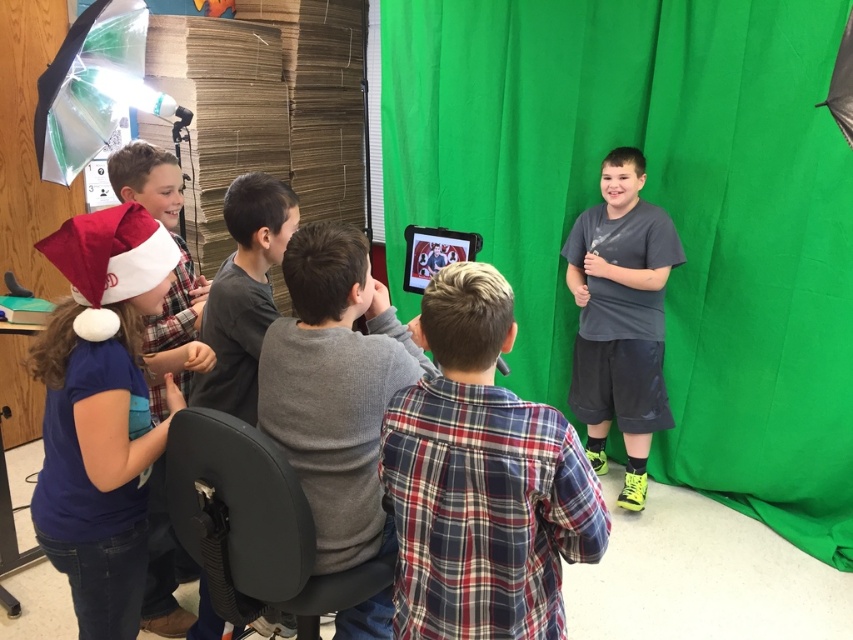
Question: Can you confirm if plaid fabric shirt at center is positioned above gray matte shirt at right?

Choices:
 (A) yes
 (B) no

Answer: (B)

Question: Which point is closer to the camera taking this photo?

Choices:
 (A) (668, 241)
 (B) (84, 394)
 (C) (560, 216)
 (D) (273, 244)

Answer: (B)

Question: Among these points, which one is nearest to the camera?

Choices:
 (A) (428, 627)
 (B) (190, 566)
 (C) (206, 384)

Answer: (A)

Question: Which of these objects is positioned farthest from the gray matte shirt at center?

Choices:
 (A) gray cotton shirt at center
 (B) plaid fabric shirt at center

Answer: (B)

Question: Can you confirm if green fabric curtain at center is thinner than gray matte shirt at right?

Choices:
 (A) no
 (B) yes

Answer: (A)

Question: Is green fabric curtain at center to the left of blue cotton shirt at left from the viewer's perspective?

Choices:
 (A) no
 (B) yes

Answer: (A)